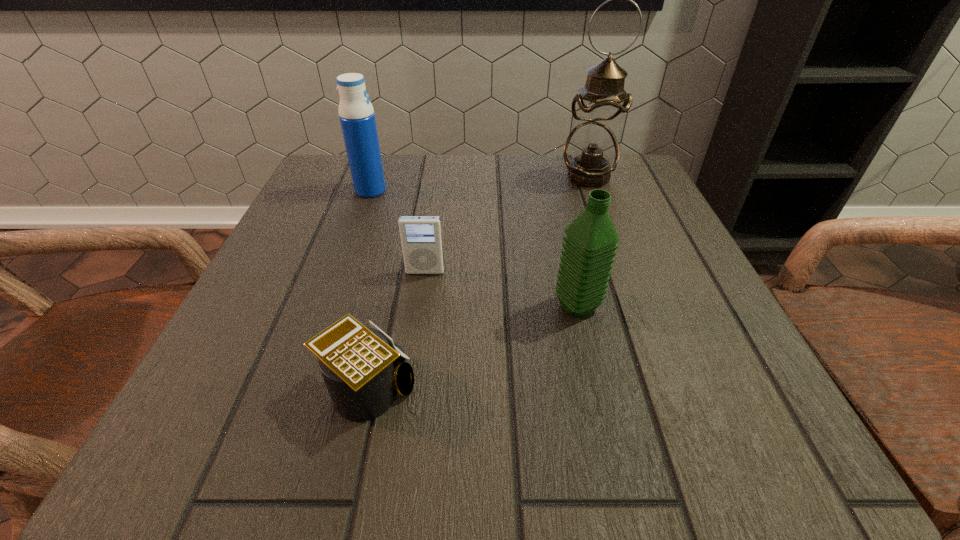
Find the location of a particular element. This screenshot has height=540, width=960. vacant space at the far edge of the desktop is located at coordinates (419, 179).

Image resolution: width=960 pixels, height=540 pixels. Find the location of `vacant area at the near edge of the desktop`. vacant area at the near edge of the desktop is located at coordinates (604, 455).

In the image, there is a desktop. Identify the location of blank space at the left edge. (314, 272).

At what (x,y) coordinates should I click in order to perform the action: click on free space at the right edge of the desktop. Please return your answer as a coordinate pair (x, y). The height and width of the screenshot is (540, 960). Looking at the image, I should click on (652, 297).

The height and width of the screenshot is (540, 960). I want to click on vacant point at the far left corner, so click(388, 155).

Locate an element on the screen. The image size is (960, 540). free region at the far right corner of the desktop is located at coordinates (636, 156).

Where is `blank space at the near right corner of the desktop`? blank space at the near right corner of the desktop is located at coordinates (724, 466).

Where is `free spot between the tallest object and the third nearest object`? Image resolution: width=960 pixels, height=540 pixels. free spot between the tallest object and the third nearest object is located at coordinates (507, 225).

Locate an element on the screen. This screenshot has width=960, height=540. free space between the calculator and the oil lamp is located at coordinates (478, 284).

Identify the location of vacant point located between the shortest object and the third farthest object. This screenshot has height=540, width=960. tap(396, 331).